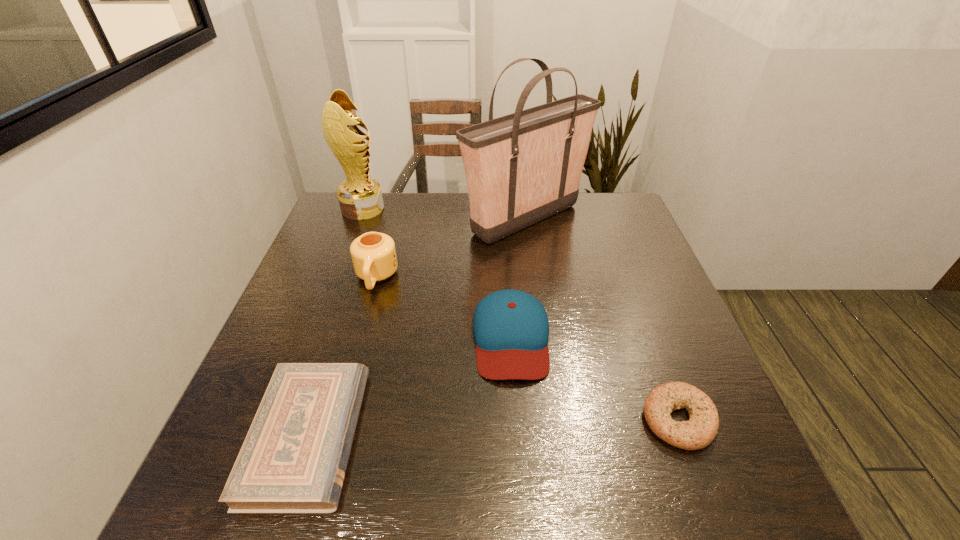
Where is `empty space between the bagel and the Bible`? empty space between the bagel and the Bible is located at coordinates pos(493,428).

Identify the location of vacant region between the Bible and the third tallest object. (342, 357).

This screenshot has width=960, height=540. What are the coordinates of `vacant space in between the shopping bag and the fourth tallest object` in the screenshot? It's located at (518, 278).

You are a GUI agent. You are given a task and a screenshot of the screen. Output one action in this format:
    pyautogui.click(x=<x>, y=<y>)
    Task: Click on the vacant region between the fourth nearest object and the tallest object
    This screenshot has width=960, height=540.
    Given the screenshot: What is the action you would take?
    pyautogui.click(x=451, y=248)

Where is `vacant space that is in between the bagel and the tallest object`? This screenshot has width=960, height=540. vacant space that is in between the bagel and the tallest object is located at coordinates [x=602, y=320].

You are a GUI agent. You are given a task and a screenshot of the screen. Output one action in this format:
    pyautogui.click(x=<x>, y=<y>)
    Task: Click on the vacant area that lies between the Bible and the shopping bag
    This screenshot has height=540, width=960.
    Given the screenshot: What is the action you would take?
    pyautogui.click(x=417, y=328)

The height and width of the screenshot is (540, 960). In order to click on free space between the award and the Bible in this screenshot , I will do `click(335, 322)`.

The width and height of the screenshot is (960, 540). Identify the location of unoccupied area between the tallest object and the fifth shortest object. (444, 214).

This screenshot has height=540, width=960. Find the location of `unoccupied position between the baseball cap and the award`. unoccupied position between the baseball cap and the award is located at coordinates (437, 273).

Where is `object that is the third nearest to the shopping bag`? The image size is (960, 540). object that is the third nearest to the shopping bag is located at coordinates (360, 197).